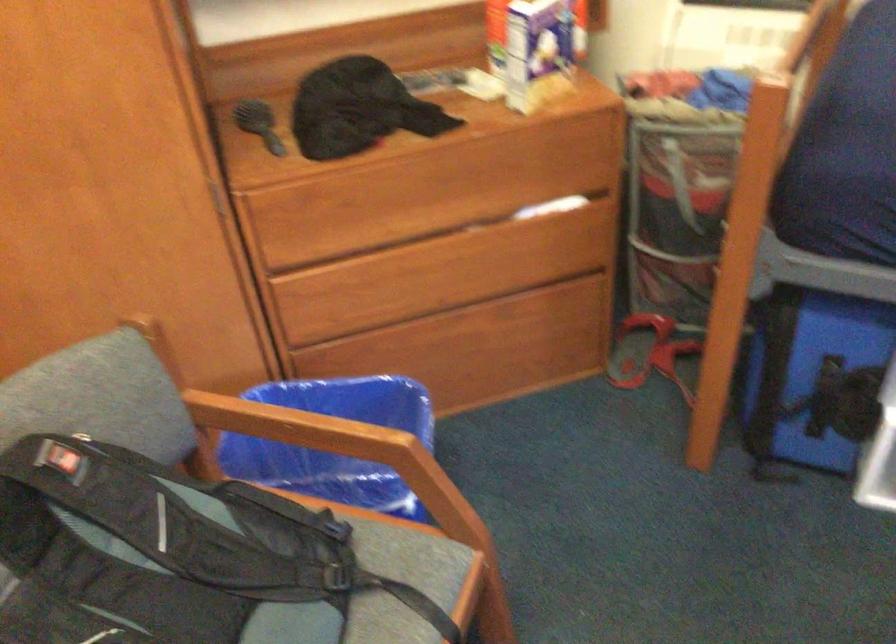
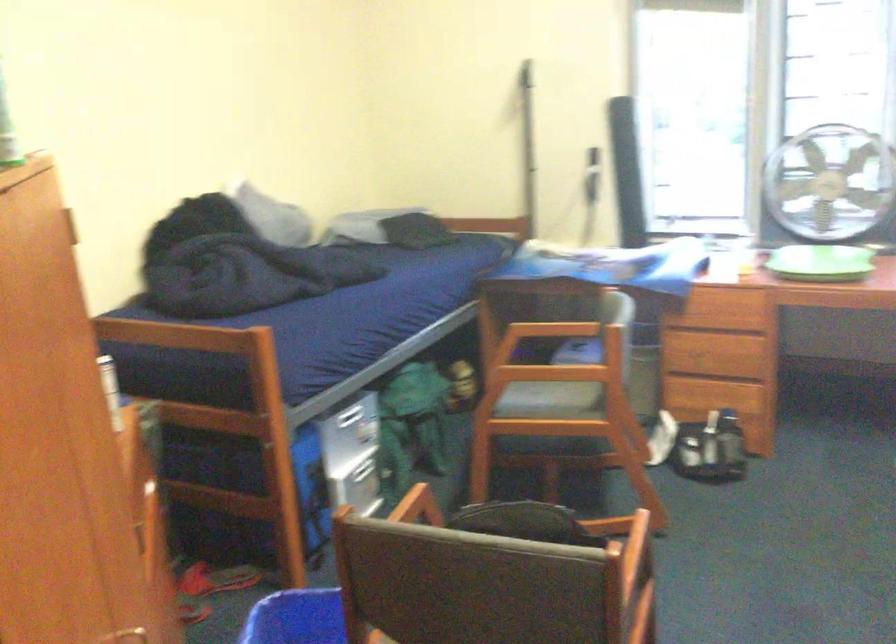
Question: I am providing you with two images of the same scene from different viewpoints. Which of the following objects are not visible in image2?

Choices:
 (A) blue plastic bin
 (B) wooden drawer edge
 (C) green circular tray
 (D) clear jar with nuts

Answer: (B)